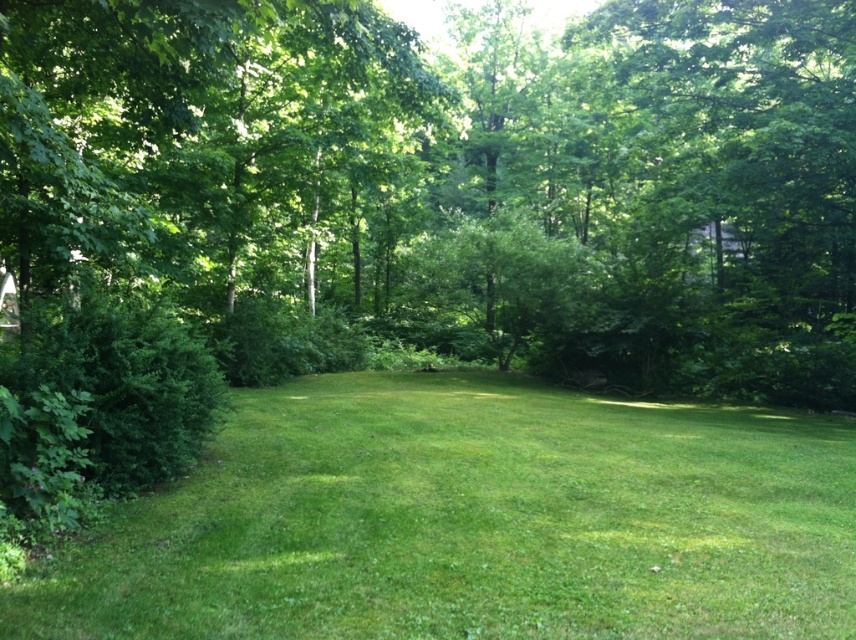
You are planning to place a picnic blanket on the green grass at center. Considering the green leafy tree at center, will there be enough space for the blanket without it being under the tree?

The green leafy tree at center might be wider than green grass at center, so there might not be enough space for the picnic blanket without it being under the tree.

Looking at this image, you are standing at the point closest to the trees in this grassy area. There are two points marked on the ground in front of you. One is labeled as point (651, 129) and the other as point (658, 508). Which point is farther away from you?

Point (651, 129) is behind point (658, 508), so the point farther away from you is point (651, 129).

You are standing at the point marked as point (x=449, y=182) in the image. What can you see directly in front of you?

At point (x=449, y=182) lies green leafy tree at center, so you can see the green leafy tree at center directly in front of you.